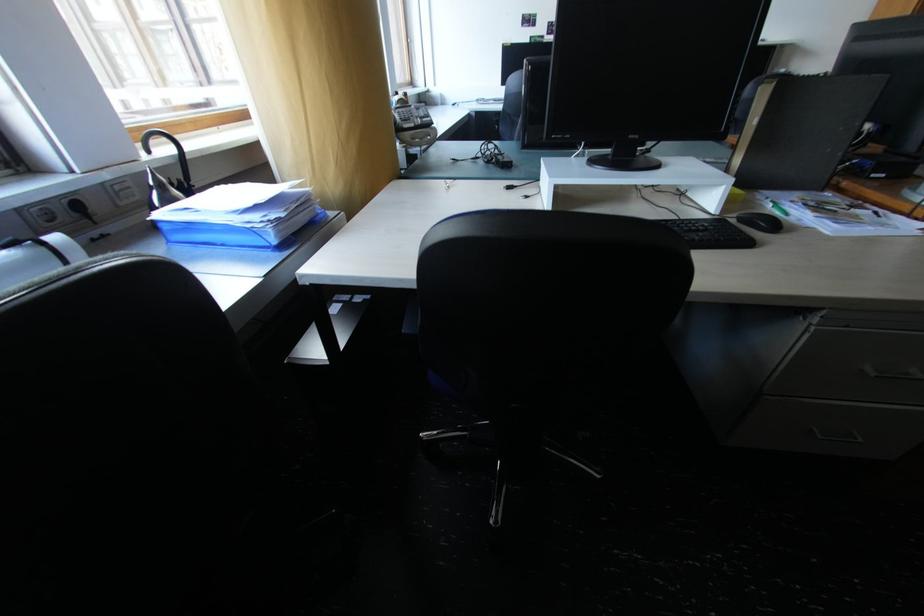
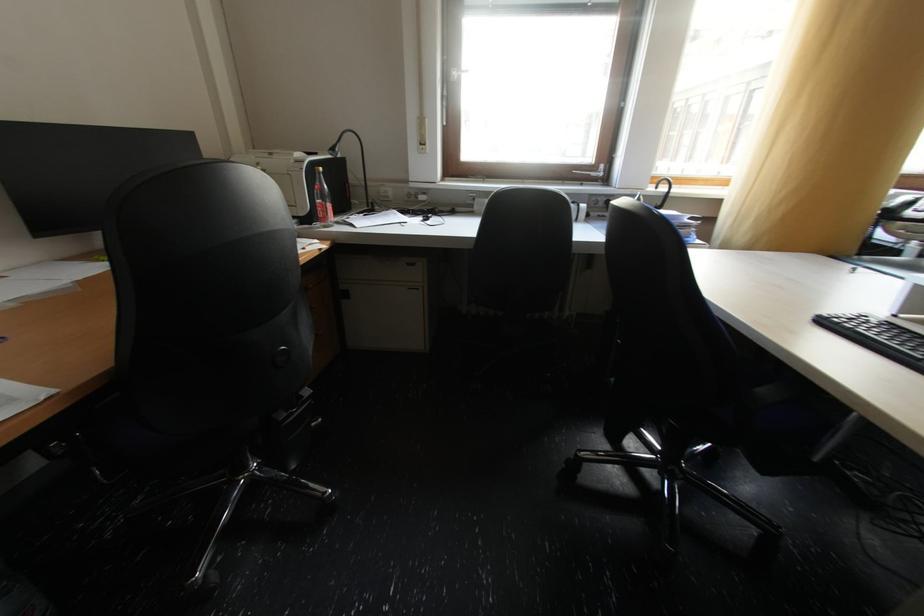
First-person continuous shooting, in which direction is the camera rotating?

The rotation direction of the camera is left-down.